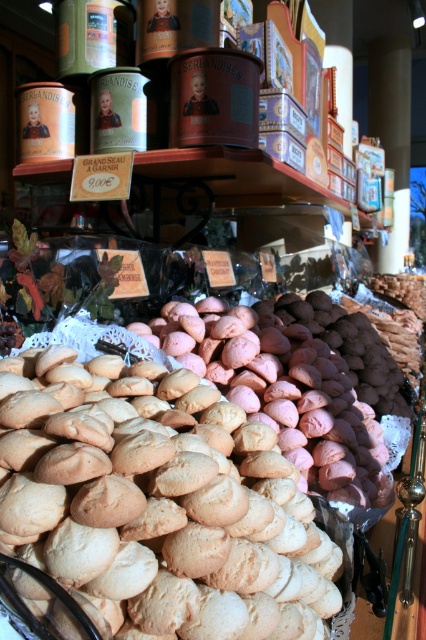
You are a customer at the bakery and want to place a small gift card between the golden brown cookie at center and the golden matte cookies at center. The gift card is 2 inches long. Do you think it will fit between them?

The golden brown cookie at center and golden matte cookies at center are 21.09 inches apart, so yes, the gift card which is 2 inches long will fit between them since the space is wider than the card.